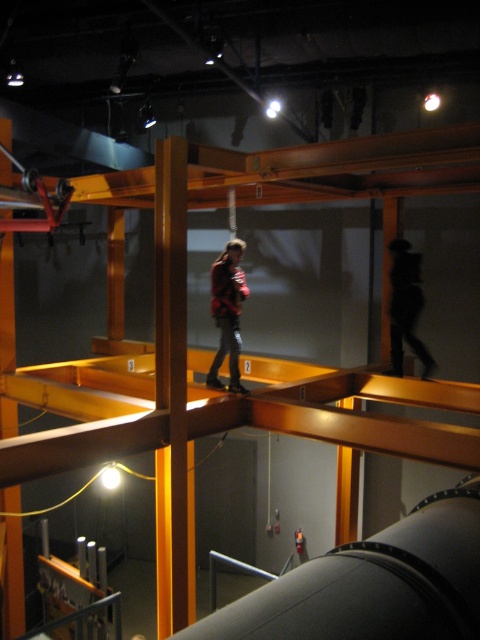
Which is behind, point (247, 292) or point (397, 259)?

The point (397, 259) is more distant.

Can you confirm if red plaid shirt at center is smaller than black matte cat at upper center?

Incorrect, red plaid shirt at center is not smaller in size than black matte cat at upper center.

Which is behind, point (233, 284) or point (409, 250)?

The point (409, 250) is behind.

Find the location of a particular element. This screenshot has height=640, width=480. red plaid shirt at center is located at coordinates (228, 312).